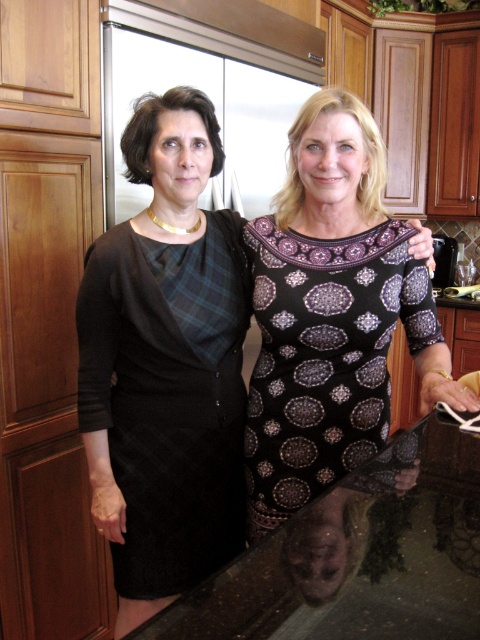
You are a fashion designer observing two women in a kitchen. The first woman is wearing a black dress with a plaid pattern on the shoulders, and the second woman has a black dress with a geometric circular pattern in purple and white. There is a specific point at coordinates point (165, 364). Can you determine which dress is located at that point?

The point (165, 364) indicates the black textured dress at center, so the dress at that point is the black textured dress at center.

You are a fashion designer observing two dresses in a photo. You need to decide which dress requires less fabric based on their thickness. The dresses are the black wool dress at left and the dark purple printed dress at center. Which dress would you choose?

The black wool dress at left is thinner than the dark purple printed dress at center, so it requires less fabric. Therefore, the black wool dress at left would be the better choice.